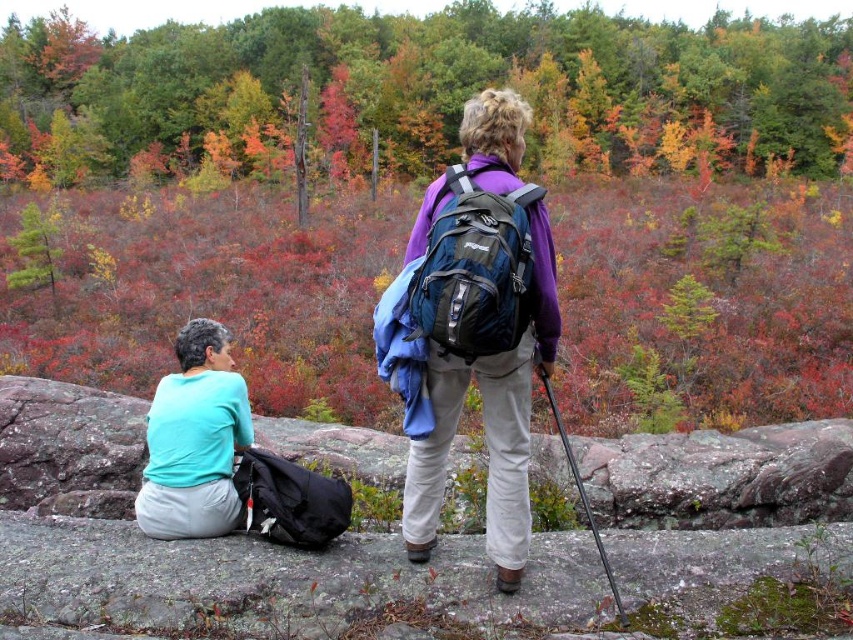
The width and height of the screenshot is (853, 640). Describe the element at coordinates (473, 326) in the screenshot. I see `purple matte jacket at center` at that location.

Measure the distance between purple matte jacket at center and camera.

purple matte jacket at center and camera are 10.92 feet apart from each other.

Between point (444, 237) and point (540, 232), which one is positioned in front?

Point (444, 237) is more forward.

Locate an element on the screen. This screenshot has width=853, height=640. purple matte jacket at center is located at coordinates 473,326.

Is autumn leaves at upper center wider than purple fabric backpack at center?

Correct, the width of autumn leaves at upper center exceeds that of purple fabric backpack at center.

How far apart are autumn leaves at upper center and purple fabric backpack at center?

The distance of autumn leaves at upper center from purple fabric backpack at center is 90.19 meters.

Which is in front, point (648, 112) or point (503, 509)?

Point (503, 509) is in front.

Where is `autumn leaves at upper center`? autumn leaves at upper center is located at coordinates (427, 90).

Who is more forward, [579,125] or [434,195]?

Point [434,195]

In the scene shown: Measure the distance from autumn leaves at upper center to blue fabric backpack at center.

autumn leaves at upper center is 91.10 meters from blue fabric backpack at center.

Does point (457, 83) come in front of point (553, 321)?

No.

What are the coordinates of `autumn leaves at upper center` in the screenshot? It's located at (427, 90).